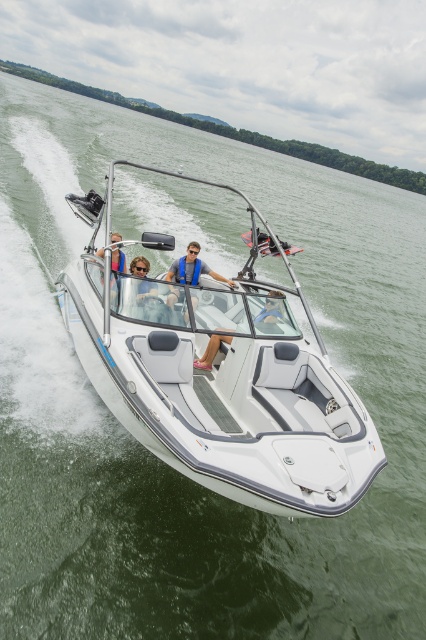
Which is above, white matte boat at center or matte black life vest at center?

Positioned higher is matte black life vest at center.

Who is more distant from viewer, (x=296, y=506) or (x=118, y=259)?

The point (x=118, y=259) is behind.

Locate an element on the screen. This screenshot has width=426, height=640. white matte boat at center is located at coordinates (222, 378).

Can you confirm if white matte boat at center is shorter than matte black sunglasses at center?

Incorrect, white matte boat at center's height does not fall short of matte black sunglasses at center's.

Is point (238, 406) behind point (126, 294)?

Yes, it is.

The width and height of the screenshot is (426, 640). I want to click on white matte boat at center, so click(222, 378).

From the picture: Who is shorter, matte blue life vest at center or matte black life vest at center?

matte blue life vest at center is shorter.

This screenshot has width=426, height=640. Identify the location of matte blue life vest at center. (192, 268).

Does point (170, 264) lie behind point (111, 282)?

Yes, it is.

Find the location of a particular element. Image resolution: width=426 pixels, height=640 pixels. matte blue life vest at center is located at coordinates (192, 268).